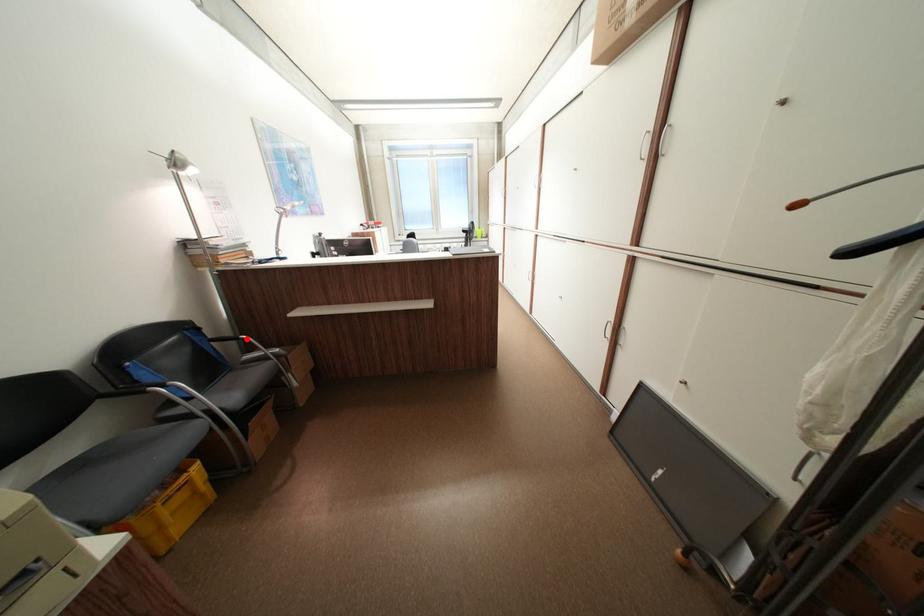
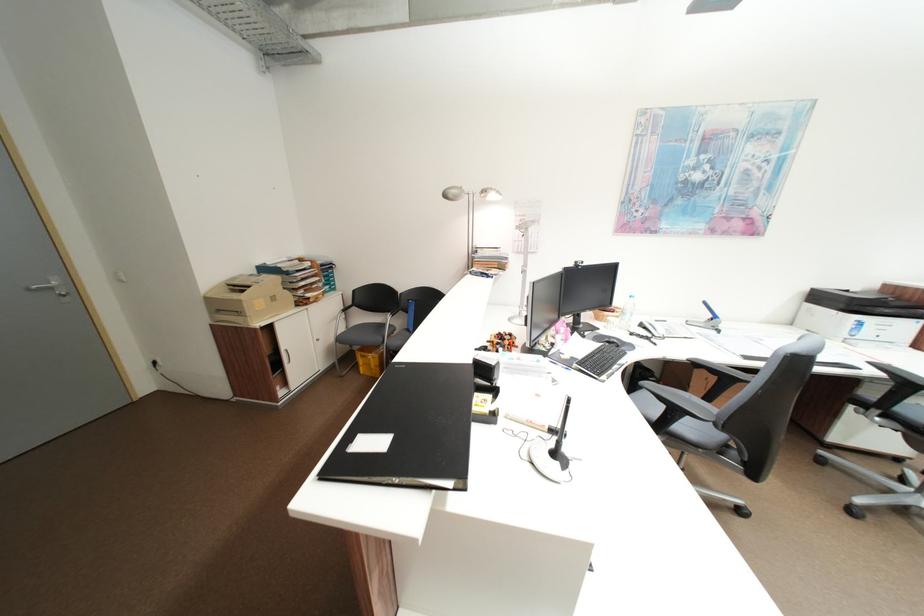
Question: I am providing you with two images of the same scene from different viewpoints. A red point is marked on the first image. At the location where the point appears in image 1, is it still visible in image 2?

Choices:
 (A) Yes
 (B) No

Answer: (B)